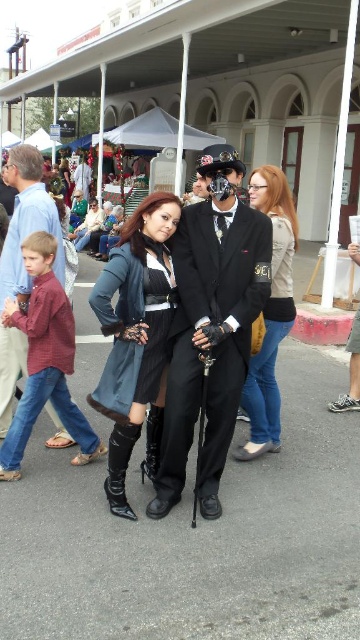
You are standing in the center of the street looking towards the historical building. There is a point at coordinates point (x=271, y=312). What object is this point located on?

The point (x=271, y=312) is located on the matte black jacket at center.

You are a photographer standing at the back of the scene. You want to take a photo of both the shiny black suit at center and the plaid shirt at left without them overlapping in the frame. Is the distance between them sufficient for you to capture both in a single shot if your camera has a 1.5 meter wide field of view?

The distance between the shiny black suit at center and plaid shirt at left is 1.36 meters, which is less than the camera field of view of 1.5 meters. Therefore, both can be captured in a single shot without overlapping.